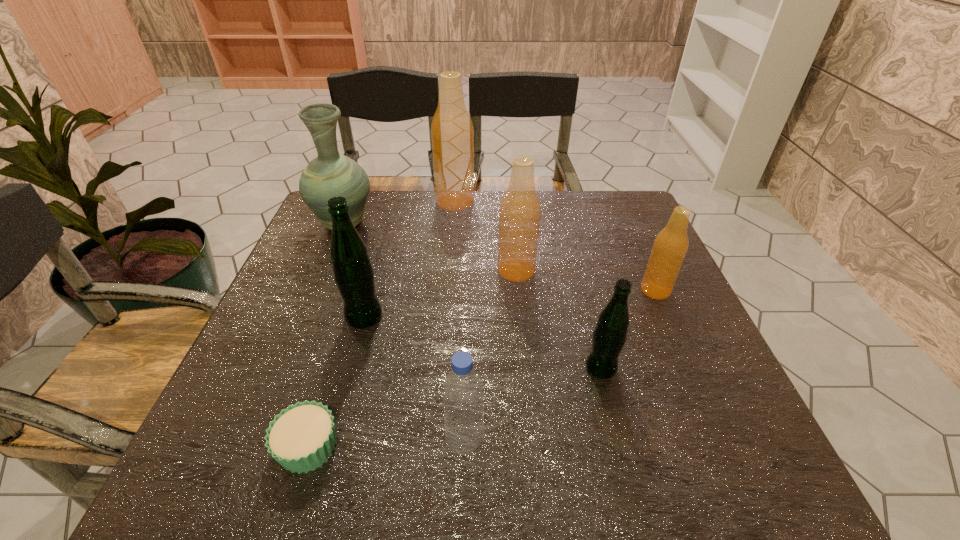
Image resolution: width=960 pixels, height=540 pixels. I want to click on object that is at the near left corner, so click(x=301, y=438).

Locate an element on the screen. The image size is (960, 540). free space at the far edge of the desktop is located at coordinates (574, 210).

You are a GUI agent. You are given a task and a screenshot of the screen. Output one action in this format:
    pyautogui.click(x=<x>, y=<y>)
    Task: Click on the vacant space at the near edge of the desktop
    The height and width of the screenshot is (540, 960).
    Given the screenshot: What is the action you would take?
    pyautogui.click(x=315, y=485)

The height and width of the screenshot is (540, 960). What are the coordinates of `vacant space at the left edge of the desktop` in the screenshot? It's located at (306, 398).

At what (x,y) coordinates should I click in order to perform the action: click on vacant area at the right edge of the desktop. Please return your answer as a coordinate pair (x, y). This screenshot has width=960, height=540. Looking at the image, I should click on (617, 239).

In the image, there is a desktop. What are the coordinates of `vacant space at the far right corner` in the screenshot? It's located at (603, 205).

Where is `vacant region between the farther green beer bottle and the biggest tan beer bottle`? Image resolution: width=960 pixels, height=540 pixels. vacant region between the farther green beer bottle and the biggest tan beer bottle is located at coordinates (410, 259).

At what (x,y) coordinates should I click in order to perform the action: click on free space between the bigger green beer bottle and the second biggest tan beer bottle. Please return your answer as a coordinate pair (x, y). The height and width of the screenshot is (540, 960). Looking at the image, I should click on (440, 294).

Image resolution: width=960 pixels, height=540 pixels. What are the coordinates of `empty location between the biggest tan beer bottle and the rightmost tan beer bottle` in the screenshot? It's located at (555, 246).

At what (x,y) coordinates should I click in order to perform the action: click on vacant area between the tallest beer bottle and the left green beer bottle. Please return your answer as a coordinate pair (x, y). This screenshot has width=960, height=540. Looking at the image, I should click on (410, 259).